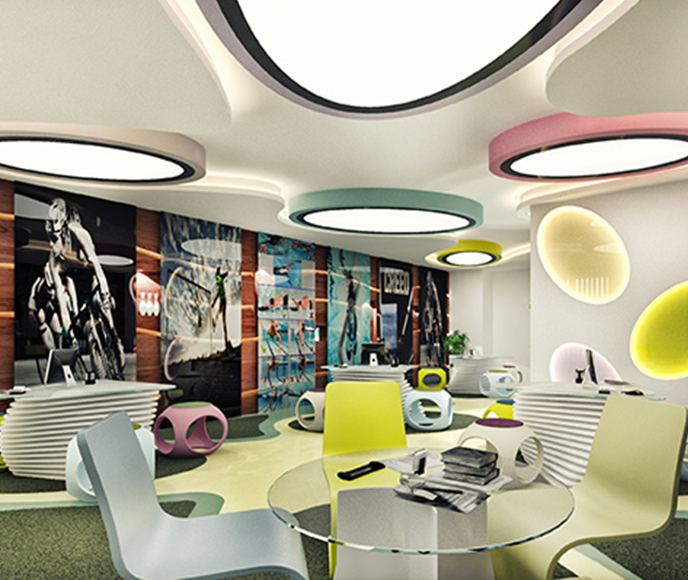
At what (x,y) coordinates should I click in order to perform the action: click on ceiling. Please return your answer as a coordinate pair (x, y). Looking at the image, I should click on (345, 148).